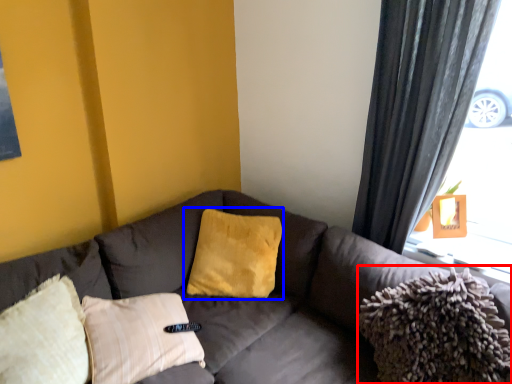
Question: Which of the following is the farthest to the observer, material (highlighted by a red box) or pillow (highlighted by a blue box)?

Choices:
 (A) material
 (B) pillow

Answer: (B)